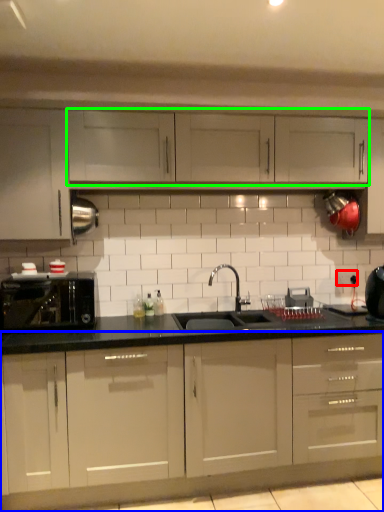
Question: Estimate the real-world distances between objects in this image. Which object is closer to electric outlet (highlighted by a red box), cabinetry (highlighted by a blue box) or cabinetry (highlighted by a green box)?

Choices:
 (A) cabinetry
 (B) cabinetry

Answer: (B)